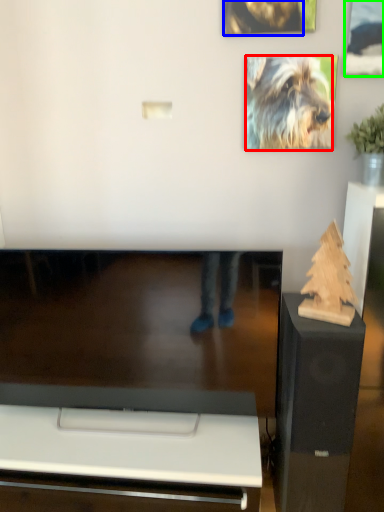
Question: Based on their relative distances, which object is farther from dog (highlighted by a red box)? Choose from dog (highlighted by a blue box) and picture frame (highlighted by a green box).

Choices:
 (A) dog
 (B) picture frame

Answer: (A)